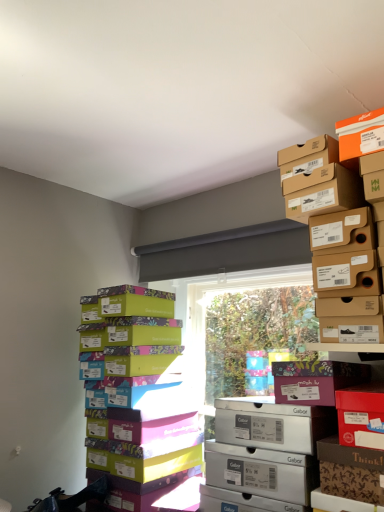
Locate an element on the screen. The height and width of the screenshot is (512, 384). floral-patterned cardboard box at center-right, marked as the 1th cardboard box in a bottom-to-top arrangement is located at coordinates (315, 380).

Locate an element on the screen. This screenshot has height=512, width=384. matte brown shoebox at upper right, acting as the 1th cardboard box starting from the top is located at coordinates (322, 192).

Image resolution: width=384 pixels, height=512 pixels. What do you see at coordinates (322, 192) in the screenshot?
I see `matte brown shoebox at upper right, which is the 2th cardboard box in bottom-to-top order` at bounding box center [322, 192].

This screenshot has height=512, width=384. Find the location of `floral-patterned cardboard box at center-right, positioned as the second cardboard box in top-to-bottom order`. floral-patterned cardboard box at center-right, positioned as the second cardboard box in top-to-bottom order is located at coordinates (315, 380).

Which cardboard box is the 1st one when counting from the back of the white cardboard shoebox at center? Please provide its 2D coordinates.

[(322, 192)]

Based on the photo, can you confirm if matte brown shoebox at upper right, which is the 2th cardboard box in bottom-to-top order, is bigger than white cardboard shoebox at center?

Incorrect, matte brown shoebox at upper right, which is the 2th cardboard box in bottom-to-top order, is not larger than white cardboard shoebox at center.

Which is more to the right, matte brown shoebox at upper right, acting as the 1th cardboard box starting from the top, or white cardboard shoebox at center?

matte brown shoebox at upper right, acting as the 1th cardboard box starting from the top.

From the image's perspective, between matte brown shoebox at upper right, which is the 2th cardboard box in bottom-to-top order, and white cardboard shoebox at center, which one is located above?

matte brown shoebox at upper right, which is the 2th cardboard box in bottom-to-top order, appears higher in the image.

Can you confirm if multicolored cardboard shoebox at left is positioned to the left of floral-patterned cardboard box at center-right, marked as the 1th cardboard box in a bottom-to-top arrangement?

Correct, you'll find multicolored cardboard shoebox at left to the left of floral-patterned cardboard box at center-right, marked as the 1th cardboard box in a bottom-to-top arrangement.

From a real-world perspective, is multicolored cardboard shoebox at left located higher than floral-patterned cardboard box at center-right, marked as the 1th cardboard box in a bottom-to-top arrangement?

No, from a real-world perspective, multicolored cardboard shoebox at left is not on top of floral-patterned cardboard box at center-right, marked as the 1th cardboard box in a bottom-to-top arrangement.

From the picture: From the image's perspective, is multicolored cardboard shoebox at left positioned above or below floral-patterned cardboard box at center-right, positioned as the second cardboard box in top-to-bottom order?

From the image's perspective, multicolored cardboard shoebox at left appears below floral-patterned cardboard box at center-right, positioned as the second cardboard box in top-to-bottom order.

Can you tell me how much multicolored cardboard shoebox at left and floral-patterned cardboard box at center-right, marked as the 1th cardboard box in a bottom-to-top arrangement, differ in facing direction?

multicolored cardboard shoebox at left and floral-patterned cardboard box at center-right, marked as the 1th cardboard box in a bottom-to-top arrangement, are facing 4.21 degrees away from each other.

From the picture: Is multicolored cardboard shoebox at left next to matte brown shoebox at upper right, acting as the 1th cardboard box starting from the top, and touching it?

No, multicolored cardboard shoebox at left is not in contact with matte brown shoebox at upper right, acting as the 1th cardboard box starting from the top.

Is multicolored cardboard shoebox at left positioned beyond the bounds of matte brown shoebox at upper right, which is the 2th cardboard box in bottom-to-top order?

Indeed, multicolored cardboard shoebox at left is completely outside matte brown shoebox at upper right, which is the 2th cardboard box in bottom-to-top order.

From a real-world perspective, is multicolored cardboard shoebox at left beneath matte brown shoebox at upper right, which is the 2th cardboard box in bottom-to-top order?

Indeed, from a real-world perspective, multicolored cardboard shoebox at left is positioned beneath matte brown shoebox at upper right, which is the 2th cardboard box in bottom-to-top order.

Does multicolored cardboard shoebox at left have a smaller size compared to matte brown shoebox at upper right, acting as the 1th cardboard box starting from the top?

Incorrect, multicolored cardboard shoebox at left is not smaller in size than matte brown shoebox at upper right, acting as the 1th cardboard box starting from the top.

In the scene shown: Does white cardboard shoebox at center have a lesser width compared to matte brown shoebox at upper right, which is the 2th cardboard box in bottom-to-top order?

Indeed, white cardboard shoebox at center has a lesser width compared to matte brown shoebox at upper right, which is the 2th cardboard box in bottom-to-top order.

How far apart are white cardboard shoebox at center and matte brown shoebox at upper right, which is the 2th cardboard box in bottom-to-top order?

A distance of 22.13 inches exists between white cardboard shoebox at center and matte brown shoebox at upper right, which is the 2th cardboard box in bottom-to-top order.

Looking at this image, from a real-world perspective, is white cardboard shoebox at center beneath matte brown shoebox at upper right, which is the 2th cardboard box in bottom-to-top order?

Yes.

You are a GUI agent. You are given a task and a screenshot of the screen. Output one action in this format:
    pyautogui.click(x=<x>, y=<y>)
    Task: Click on the shelf in front of the matte brown shoebox at upper right, acting as the 1th cardboard box starting from the top
    
    Given the screenshot: What is the action you would take?
    pyautogui.click(x=267, y=447)

Which is behind, floral-patterned cardboard box at center-right, positioned as the second cardboard box in top-to-bottom order, or multicolored cardboard shoebox at left?

Positioned behind is multicolored cardboard shoebox at left.

From the image's perspective, does floral-patterned cardboard box at center-right, marked as the 1th cardboard box in a bottom-to-top arrangement, appear higher than multicolored cardboard shoebox at left?

Yes, from the image's perspective, floral-patterned cardboard box at center-right, marked as the 1th cardboard box in a bottom-to-top arrangement, is above multicolored cardboard shoebox at left.

Would you say floral-patterned cardboard box at center-right, marked as the 1th cardboard box in a bottom-to-top arrangement, is to the left or to the right of multicolored cardboard shoebox at left in the picture?

From the image, it's evident that floral-patterned cardboard box at center-right, marked as the 1th cardboard box in a bottom-to-top arrangement, is to the right of multicolored cardboard shoebox at left.

What's the angular difference between floral-patterned cardboard box at center-right, positioned as the second cardboard box in top-to-bottom order, and multicolored cardboard shoebox at left's facing directions?

floral-patterned cardboard box at center-right, positioned as the second cardboard box in top-to-bottom order, and multicolored cardboard shoebox at left are facing 4.21 degrees away from each other.

Is point (111, 325) closer to viewer compared to point (236, 449)?

No, (111, 325) is behind (236, 449).

Who is shorter, multicolored cardboard shoebox at left or white cardboard shoebox at center?

white cardboard shoebox at center is shorter.

From the image's perspective, which is above, white cardboard shoebox at center or multicolored cardboard shoebox at left?

multicolored cardboard shoebox at left is shown above in the image.

The image size is (384, 512). What are the coordinates of `package above the white cardboard shoebox at center (from the image's perspective)` in the screenshot? It's located at (139, 399).

Which object is thinner, white cardboard shoebox at center or multicolored cardboard shoebox at left?

Thinner between the two is white cardboard shoebox at center.

Identify the location of the 2nd cardboard box located above the white cardboard shoebox at center (from a real-world perspective). This screenshot has width=384, height=512. (322, 192).

This screenshot has width=384, height=512. I want to click on the 1st cardboard box positioned above the multicolored cardboard shoebox at left (from the image's perspective), so click(315, 380).

From the image, which object appears to be nearer to multicolored cardboard shoebox at left, white cardboard shoebox at center or floral-patterned cardboard box at center-right, marked as the 1th cardboard box in a bottom-to-top arrangement?

white cardboard shoebox at center is closer to multicolored cardboard shoebox at left.

Looking at the image, which one is located further to floral-patterned cardboard box at center-right, positioned as the second cardboard box in top-to-bottom order, matte brown shoebox at upper right, acting as the 1th cardboard box starting from the top, or multicolored cardboard shoebox at left?

The object further to floral-patterned cardboard box at center-right, positioned as the second cardboard box in top-to-bottom order, is multicolored cardboard shoebox at left.

From the image, which object appears to be farther from white cardboard shoebox at center, multicolored cardboard shoebox at left or floral-patterned cardboard box at center-right, marked as the 1th cardboard box in a bottom-to-top arrangement?

multicolored cardboard shoebox at left.

From the image, which object appears to be farther from matte brown shoebox at upper right, which is the 2th cardboard box in bottom-to-top order, floral-patterned cardboard box at center-right, positioned as the second cardboard box in top-to-bottom order, or white cardboard shoebox at center?

white cardboard shoebox at center.

Which object lies further to the anchor point white cardboard shoebox at center, multicolored cardboard shoebox at left or matte brown shoebox at upper right, acting as the 1th cardboard box starting from the top?

The object further to white cardboard shoebox at center is matte brown shoebox at upper right, acting as the 1th cardboard box starting from the top.

Looking at the image, which one is located closer to floral-patterned cardboard box at center-right, positioned as the second cardboard box in top-to-bottom order, multicolored cardboard shoebox at left or white cardboard shoebox at center?

white cardboard shoebox at center is closer to floral-patterned cardboard box at center-right, positioned as the second cardboard box in top-to-bottom order.

From the image, which object appears to be farther from matte brown shoebox at upper right, acting as the 1th cardboard box starting from the top, floral-patterned cardboard box at center-right, marked as the 1th cardboard box in a bottom-to-top arrangement, or multicolored cardboard shoebox at left?

multicolored cardboard shoebox at left lies further to matte brown shoebox at upper right, acting as the 1th cardboard box starting from the top, than the other object.

When comparing their distances from matte brown shoebox at upper right, which is the 2th cardboard box in bottom-to-top order, does multicolored cardboard shoebox at left or floral-patterned cardboard box at center-right, positioned as the second cardboard box in top-to-bottom order, seem further?

multicolored cardboard shoebox at left is positioned further to the anchor matte brown shoebox at upper right, which is the 2th cardboard box in bottom-to-top order.

Identify the location of package between matte brown shoebox at upper right, acting as the 1th cardboard box starting from the top, and white cardboard shoebox at center from top to bottom. This screenshot has width=384, height=512. (139, 399).

What are the coordinates of `shelf between multicolored cardboard shoebox at left and floral-patterned cardboard box at center-right, marked as the 1th cardboard box in a bottom-to-top arrangement, from left to right` in the screenshot? It's located at (267, 447).

In order to click on cardboard box that lies between matte brown shoebox at upper right, which is the 2th cardboard box in bottom-to-top order, and white cardboard shoebox at center from top to bottom in this screenshot , I will do `click(315, 380)`.

Find the location of a particular element. The image size is (384, 512). cardboard box between multicolored cardboard shoebox at left and matte brown shoebox at upper right, acting as the 1th cardboard box starting from the top is located at coordinates (315, 380).